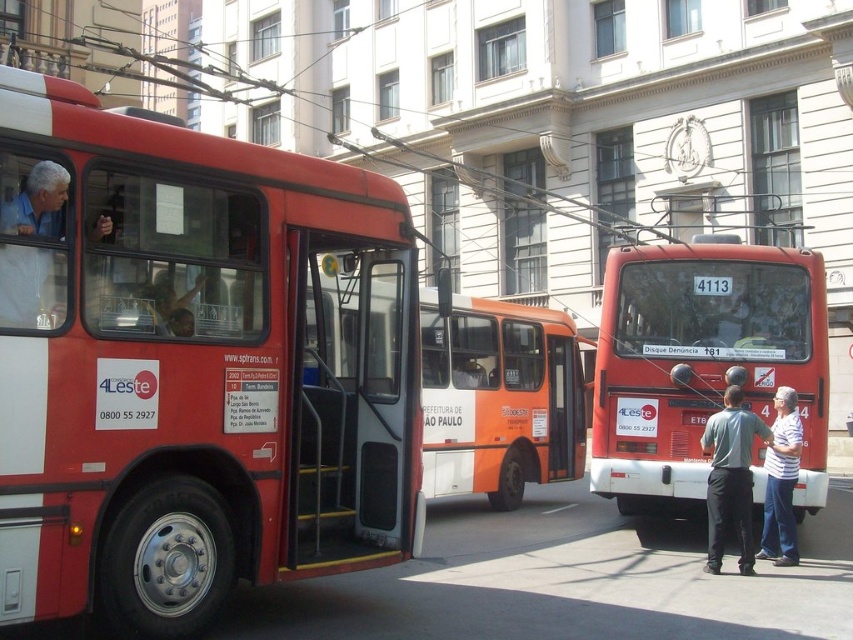
Does matte red bus at left have a greater height compared to gray cotton shirt at center?

Correct, matte red bus at left is much taller as gray cotton shirt at center.

Is matte red bus at left in front of gray cotton shirt at center?

That is True.

The height and width of the screenshot is (640, 853). Describe the element at coordinates (193, 365) in the screenshot. I see `matte red bus at left` at that location.

At what (x,y) coordinates should I click in order to perform the action: click on matte red bus at left. Please return your answer as a coordinate pair (x, y). Image resolution: width=853 pixels, height=640 pixels. Looking at the image, I should click on (193, 365).

Which of these two, matte red bus at center or orange matte bus at center, stands shorter?

Standing shorter between the two is orange matte bus at center.

The height and width of the screenshot is (640, 853). In order to click on matte red bus at center in this screenshot , I will do `click(701, 364)`.

Identify the location of matte red bus at center. Image resolution: width=853 pixels, height=640 pixels. (701, 364).

Who is taller, orange matte bus at center or white striped shirt at lower right?

Standing taller between the two is white striped shirt at lower right.

Does point (527, 342) come in front of point (788, 477)?

No, it is not.

Is point (448, 470) closer to camera compared to point (772, 509)?

No, (448, 470) is behind (772, 509).

Locate an element on the screen. The height and width of the screenshot is (640, 853). orange matte bus at center is located at coordinates (498, 397).